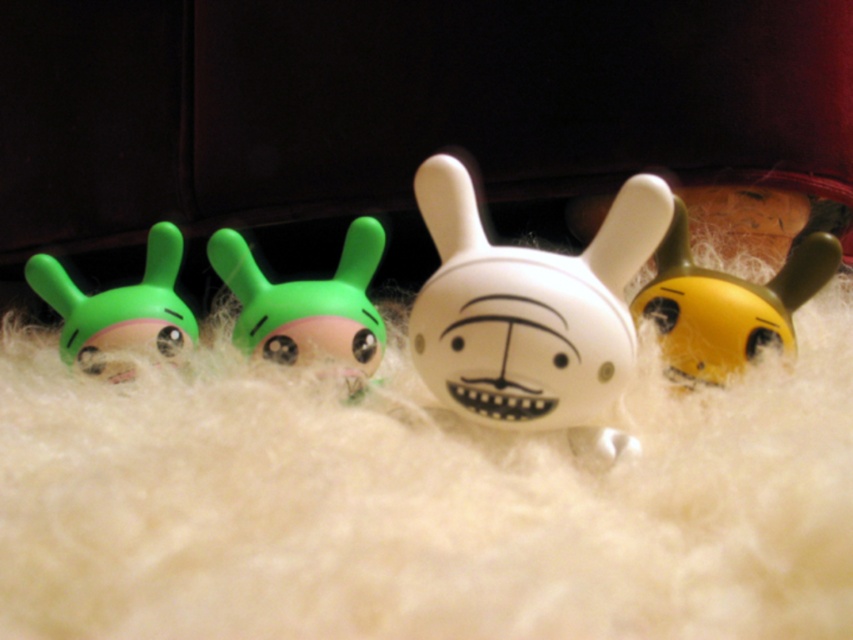
Between white matte rabbit at center and matte green rabbit at center, which one appears on the right side from the viewer's perspective?

white matte rabbit at center

Is white matte rabbit at center positioned behind matte green rabbit at center?

No, white matte rabbit at center is in front of matte green rabbit at center.

Is point (624, 378) positioned before point (320, 333)?

Yes, it is in front of point (320, 333).

The width and height of the screenshot is (853, 640). Identify the location of white matte rabbit at center. (531, 314).

Is the position of green matte toy at left more distant than that of matte green rabbit at center?

Yes.

Can you confirm if green matte toy at left is thinner than matte green rabbit at center?

No.

Does point (30, 275) come behind point (322, 346)?

Yes, point (30, 275) is farther from viewer.

I want to click on green matte toy at left, so click(119, 308).

The height and width of the screenshot is (640, 853). Describe the element at coordinates (726, 305) in the screenshot. I see `yellow matte toy at right` at that location.

Consider the image. Is yellow matte toy at right taller than matte green bunny at center?

Indeed, yellow matte toy at right has a greater height compared to matte green bunny at center.

Who is more forward, [717,371] or [242,308]?

Point [717,371] is more forward.

You are a GUI agent. You are given a task and a screenshot of the screen. Output one action in this format:
    pyautogui.click(x=<x>, y=<y>)
    Task: Click on the yellow matte toy at right
    The image size is (853, 640).
    Given the screenshot: What is the action you would take?
    pyautogui.click(x=726, y=305)